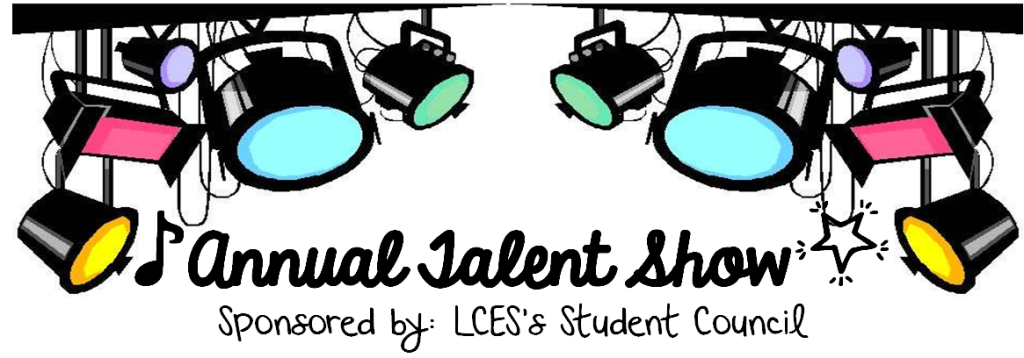
Find the location of `pink light`. pink light is located at coordinates (915, 134).